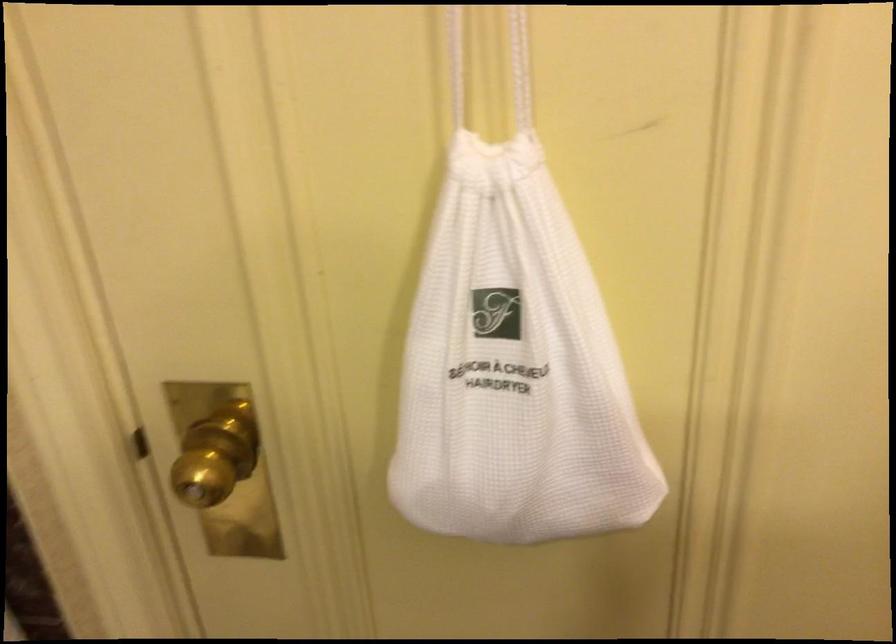
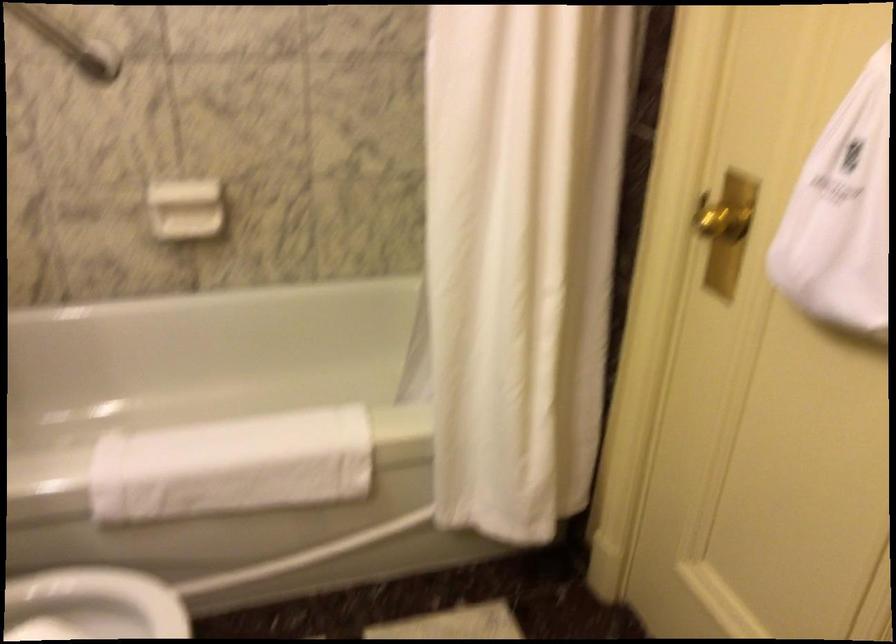
The point at (x=220, y=480) is marked in the first image. Where is the corresponding point in the second image?

(722, 222)